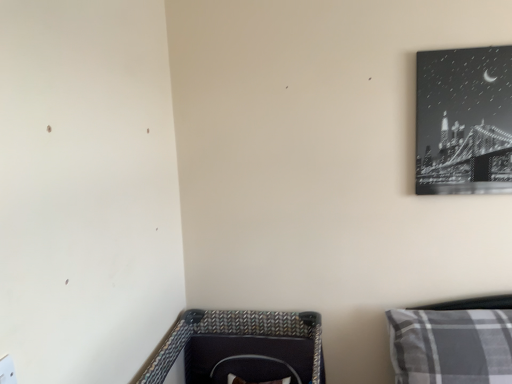
Question: Considering the relative sizes of black glossy canvas at upper right and gray plaid pillow at lower right in the image provided, is black glossy canvas at upper right bigger than gray plaid pillow at lower right?

Choices:
 (A) yes
 (B) no

Answer: (B)

Question: Could gray plaid pillow at lower right be considered to be inside black glossy canvas at upper right?

Choices:
 (A) no
 (B) yes

Answer: (A)

Question: Does black glossy canvas at upper right appear on the right side of gray plaid pillow at lower right?

Choices:
 (A) no
 (B) yes

Answer: (B)

Question: Would you consider black glossy canvas at upper right to be distant from gray plaid pillow at lower right?

Choices:
 (A) yes
 (B) no

Answer: (B)

Question: Can you see black glossy canvas at upper right touching gray plaid pillow at lower right?

Choices:
 (A) yes
 (B) no

Answer: (B)

Question: Can you confirm if black glossy canvas at upper right is shorter than gray plaid pillow at lower right?

Choices:
 (A) yes
 (B) no

Answer: (B)

Question: Is gray plaid pillow at lower right positioned beyond the bounds of black glossy canvas at upper right?

Choices:
 (A) yes
 (B) no

Answer: (A)

Question: Is gray plaid pillow at lower right oriented away from black glossy canvas at upper right?

Choices:
 (A) yes
 (B) no

Answer: (B)

Question: From a real-world perspective, is gray plaid pillow at lower right physically above black glossy canvas at upper right?

Choices:
 (A) no
 (B) yes

Answer: (A)

Question: Is gray plaid pillow at lower right with black glossy canvas at upper right?

Choices:
 (A) yes
 (B) no

Answer: (B)

Question: Is gray plaid pillow at lower right aimed at black glossy canvas at upper right?

Choices:
 (A) yes
 (B) no

Answer: (B)

Question: From a real-world perspective, is gray plaid pillow at lower right below black glossy canvas at upper right?

Choices:
 (A) no
 (B) yes

Answer: (B)

Question: Is gray plaid pillow at lower right to the left or to the right of black glossy canvas at upper right in the image?

Choices:
 (A) left
 (B) right

Answer: (A)